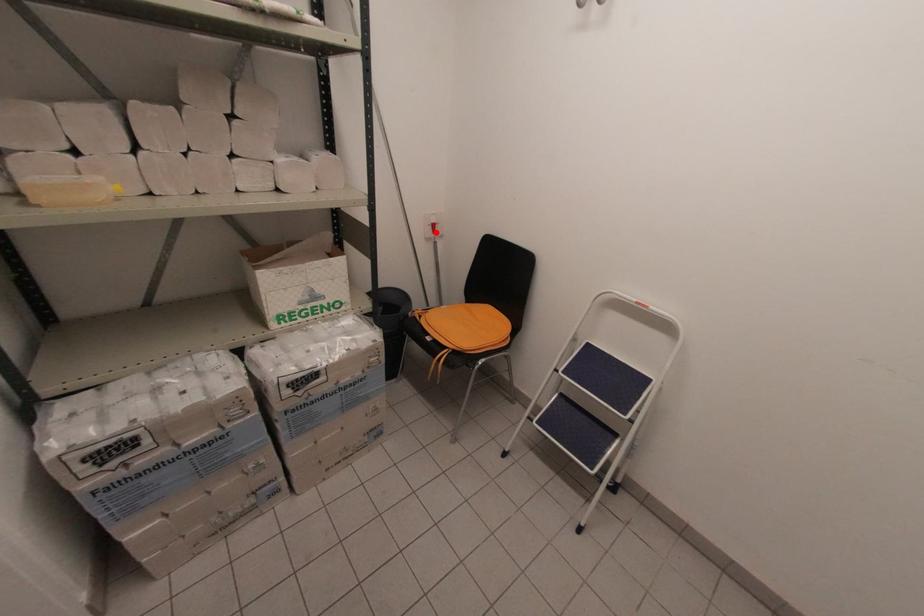
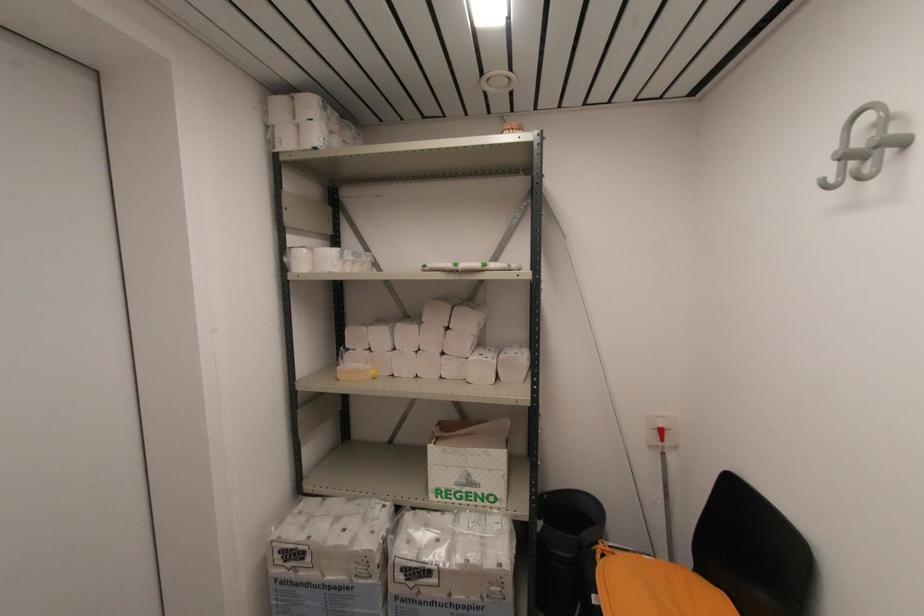
Question: A red point is marked in image1. In image2, is the corresponding 3D point closer to the camera or farther? Reply with the corresponding letter.

Choices:
 (A) The corresponding 3D point is closer.
 (B) The corresponding 3D point is farther.

Answer: (B)